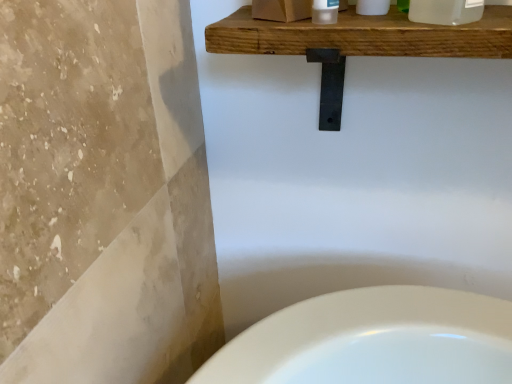
Identify the location of transparent plastic bottle at upper right. The height and width of the screenshot is (384, 512). (445, 11).

What is the approximate width of transparent plastic bottle at upper right?

It is 2.59 inches.

In order to face transparent plastic bottle at upper right, should I rotate leftwards or rightwards?

Rotate right and turn 25.587 degrees.

Measure the distance between point [443,12] and camera.

The depth of point [443,12] is 20.04 inches.

Image resolution: width=512 pixels, height=384 pixels. Describe the element at coordinates (445, 11) in the screenshot. I see `transparent plastic bottle at upper right` at that location.

This screenshot has height=384, width=512. What do you see at coordinates (359, 43) in the screenshot? I see `wooden shelf at upper center` at bounding box center [359, 43].

The width and height of the screenshot is (512, 384). Identify the location of wooden shelf at upper center. (359, 43).

I want to click on transparent plastic bottle at upper right, so click(445, 11).

Is wooden shelf at upper center at the right side of transparent plastic bottle at upper right?

Incorrect, wooden shelf at upper center is not on the right side of transparent plastic bottle at upper right.

Considering the relative positions of wooden shelf at upper center and transparent plastic bottle at upper right in the image provided, is wooden shelf at upper center in front of transparent plastic bottle at upper right?

No.

Considering the points (332, 35) and (453, 10), which point is in front, point (332, 35) or point (453, 10)?

Point (453, 10)

Based on the photo, from the image's perspective, is wooden shelf at upper center above or below transparent plastic bottle at upper right?

Clearly, from the image's perspective, wooden shelf at upper center is below transparent plastic bottle at upper right.

From a real-world perspective, who is located lower, wooden shelf at upper center or transparent plastic bottle at upper right?

wooden shelf at upper center, from a real-world perspective.

Can you confirm if wooden shelf at upper center is thinner than transparent plastic bottle at upper right?

In fact, wooden shelf at upper center might be wider than transparent plastic bottle at upper right.

Considering the relative sizes of wooden shelf at upper center and transparent plastic bottle at upper right in the image provided, is wooden shelf at upper center shorter than transparent plastic bottle at upper right?

In fact, wooden shelf at upper center may be taller than transparent plastic bottle at upper right.

Between wooden shelf at upper center and transparent plastic bottle at upper right, which one has smaller size?

Smaller between the two is transparent plastic bottle at upper right.

Is wooden shelf at upper center located outside transparent plastic bottle at upper right?

Yes, wooden shelf at upper center is located beyond the bounds of transparent plastic bottle at upper right.

Would you consider wooden shelf at upper center to be distant from transparent plastic bottle at upper right?

No, there isn't a large distance between wooden shelf at upper center and transparent plastic bottle at upper right.

Does wooden shelf at upper center turn towards transparent plastic bottle at upper right?

No, wooden shelf at upper center is not facing towards transparent plastic bottle at upper right.

Identify the location of balustrade that is under the transparent plastic bottle at upper right (from a real-world perspective). (359, 43).

Looking at this image, does transparent plastic bottle at upper right appear on the left side of wooden shelf at upper center?

No.

Considering their positions, is transparent plastic bottle at upper right located in front of or behind wooden shelf at upper center?

In the image, transparent plastic bottle at upper right appears in front of wooden shelf at upper center.

Does point (440, 8) come farther from viewer compared to point (313, 59)?

No, it is not.

From the image's perspective, is transparent plastic bottle at upper right below wooden shelf at upper center?

Actually, transparent plastic bottle at upper right appears above wooden shelf at upper center in the image.

From a real-world perspective, which object stands above the other?

transparent plastic bottle at upper right.

Considering the sizes of transparent plastic bottle at upper right and wooden shelf at upper center in the image, is transparent plastic bottle at upper right wider or thinner than wooden shelf at upper center?

transparent plastic bottle at upper right is thinner than wooden shelf at upper center.

Considering the sizes of objects transparent plastic bottle at upper right and wooden shelf at upper center in the image provided, who is shorter, transparent plastic bottle at upper right or wooden shelf at upper center?

transparent plastic bottle at upper right.

Can you confirm if transparent plastic bottle at upper right is smaller than wooden shelf at upper center?

Yes.

Looking at this image, is transparent plastic bottle at upper right spatially inside wooden shelf at upper center, or outside of it?

transparent plastic bottle at upper right cannot be found inside wooden shelf at upper center.

From the picture: Is transparent plastic bottle at upper right in contact with wooden shelf at upper center?

transparent plastic bottle at upper right is not next to wooden shelf at upper center, and they're not touching.

Is transparent plastic bottle at upper right facing towards wooden shelf at upper center?

No.

I want to click on cleaning product located in front of the wooden shelf at upper center, so point(445,11).

Find the location of a particular element. This screenshot has width=512, height=384. cleaning product above the wooden shelf at upper center (from the image's perspective) is located at coordinates (445, 11).

Locate an element on the screen. The width and height of the screenshot is (512, 384). balustrade on the left of transparent plastic bottle at upper right is located at coordinates (359, 43).